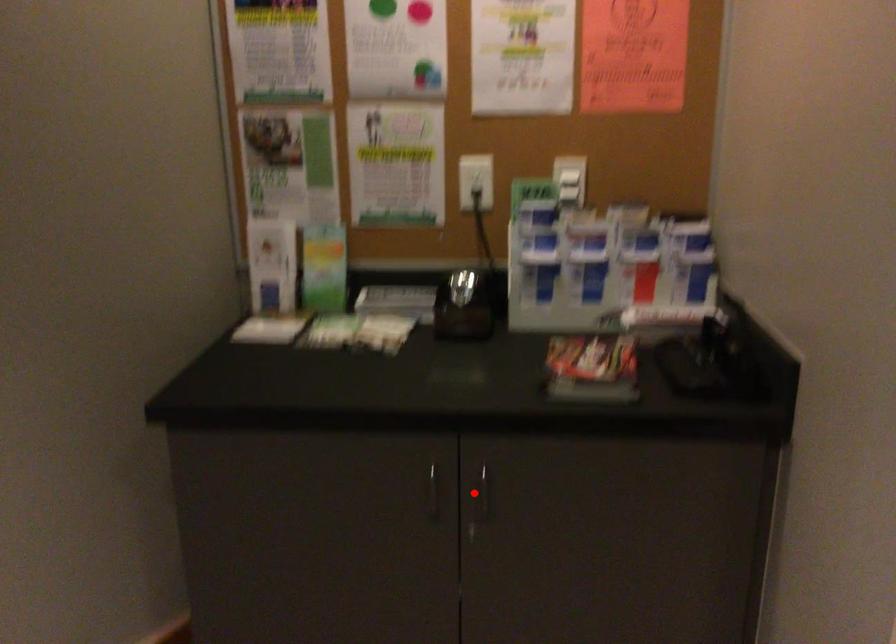
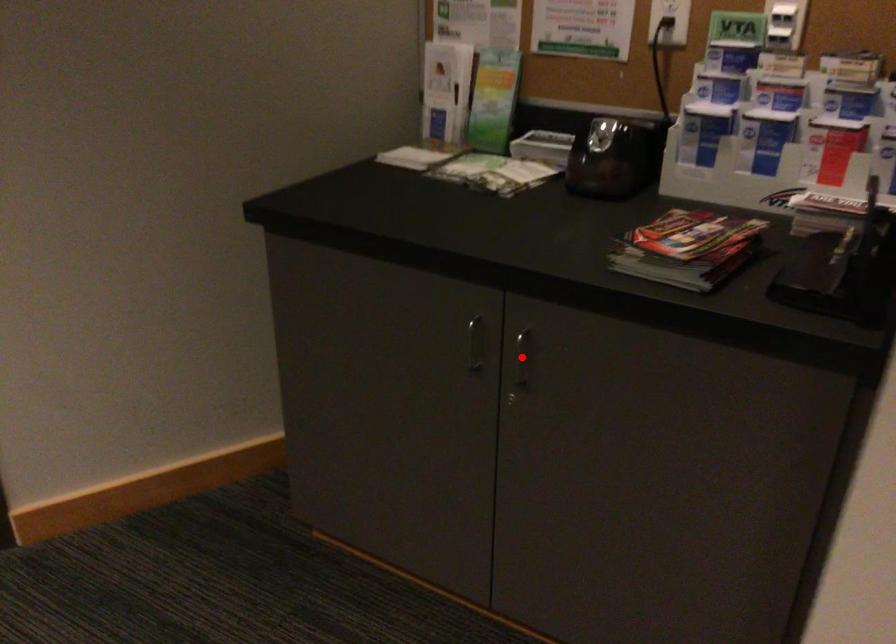
I am providing you with two images of the same scene from different viewpoints. A red point is marked on the first image and another point is marked on the second image. Are the points marked in image1 and image2 representing the same 3D position?

Yes